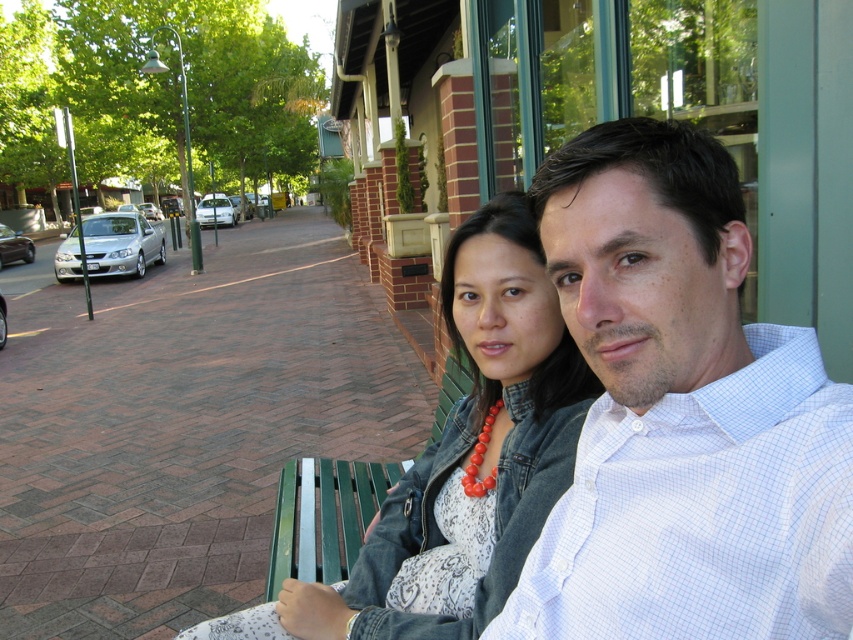
Between white checkered shirt at center and denim jacket at center, which one is positioned lower?

denim jacket at center is below.

The image size is (853, 640). I want to click on white checkered shirt at center, so click(x=682, y=413).

Does point (776, 365) lie behind point (515, 428)?

No.

Where is `white checkered shirt at center`? The width and height of the screenshot is (853, 640). white checkered shirt at center is located at coordinates (682, 413).